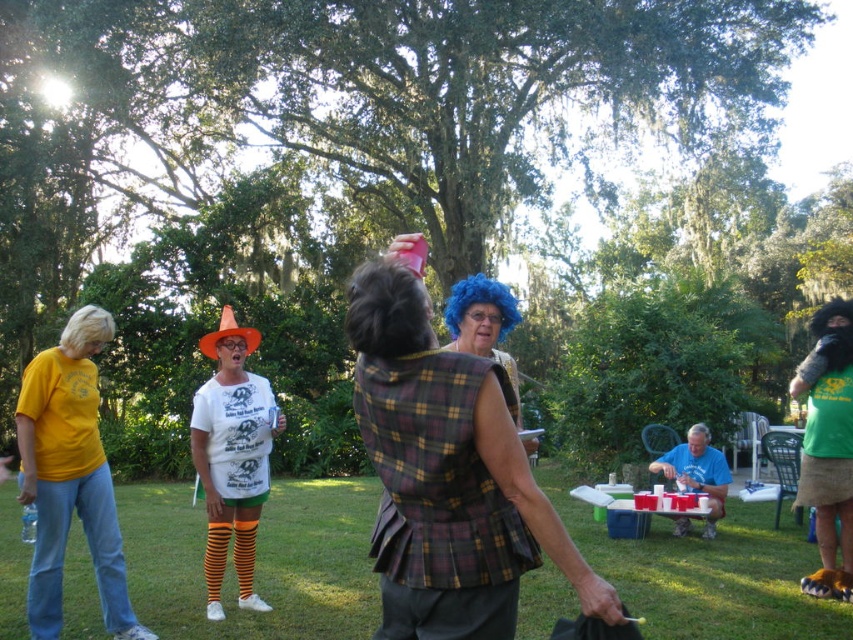
What do you see at coordinates (697, 472) in the screenshot? This screenshot has width=853, height=640. I see `blue plaid vest at center` at bounding box center [697, 472].

Does point (689, 486) come closer to viewer compared to point (74, 344)?

No, (689, 486) is behind (74, 344).

Who is more forward, (711, 474) or (67, 332)?

Point (67, 332) is more forward.

Where is `blue plaid vest at center`? Image resolution: width=853 pixels, height=640 pixels. blue plaid vest at center is located at coordinates (697, 472).

Is orange striped tights at center thinner than blue synthetic wig at center?

Yes, orange striped tights at center is thinner than blue synthetic wig at center.

Can you confirm if orange striped tights at center is bigger than blue synthetic wig at center?

Incorrect, orange striped tights at center is not larger than blue synthetic wig at center.

At what (x,y) coordinates should I click in order to perform the action: click on orange striped tights at center. Please return your answer as a coordinate pair (x, y). Looking at the image, I should click on (231, 458).

Who is higher up, blue synthetic wig at center or blonde synthetic wig at upper left?

blue synthetic wig at center

Is blue synthetic wig at center thinner than blonde synthetic wig at upper left?

Yes, blue synthetic wig at center is thinner than blonde synthetic wig at upper left.

Locate an element on the screen. blue synthetic wig at center is located at coordinates (387, 310).